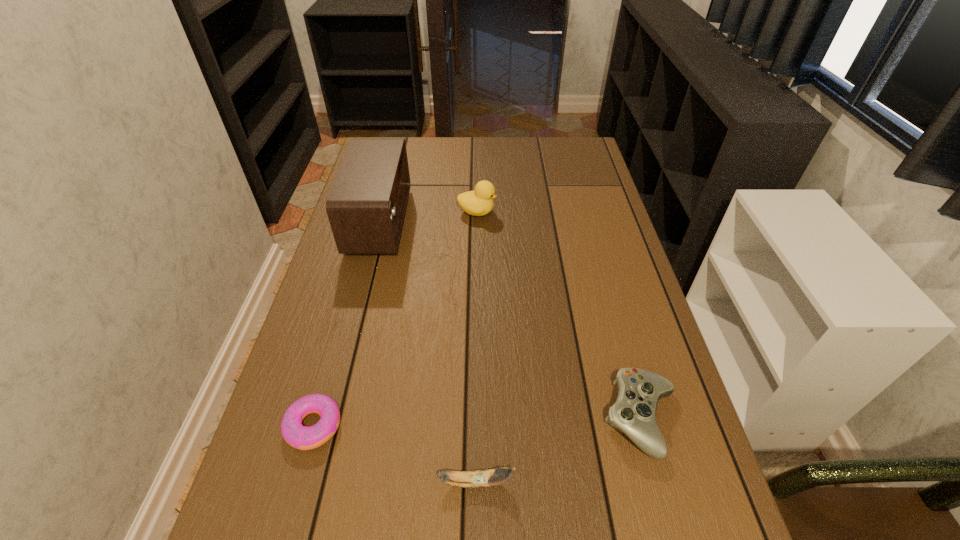
Find the location of a particular element. radio receiver present at the left edge is located at coordinates (366, 206).

Image resolution: width=960 pixels, height=540 pixels. Identify the location of doughnut that is at the left edge. (301, 437).

Locate an element on the screen. This screenshot has height=540, width=960. object that is at the right edge is located at coordinates (634, 413).

You are a GUI agent. You are given a task and a screenshot of the screen. Output one action in this format:
    pyautogui.click(x=<x>, y=<y>)
    Task: Click on the free space at the far edge of the desktop
    Image resolution: width=960 pixels, height=540 pixels.
    Given the screenshot: What is the action you would take?
    pyautogui.click(x=494, y=161)

The width and height of the screenshot is (960, 540). Find the location of `free region at the left edge`. free region at the left edge is located at coordinates (341, 276).

Identify the location of blank space at the right edge. The image size is (960, 540). (636, 287).

The image size is (960, 540). In order to click on free point at the far left corner in this screenshot , I will do click(373, 138).

The width and height of the screenshot is (960, 540). Identify the location of vacant space at the far right corner. (578, 141).

The height and width of the screenshot is (540, 960). In order to click on free spot between the doughnut and the tallest object in this screenshot , I will do `click(347, 324)`.

I want to click on vacant space that is in between the nearest object and the fourth shortest object, so click(476, 347).